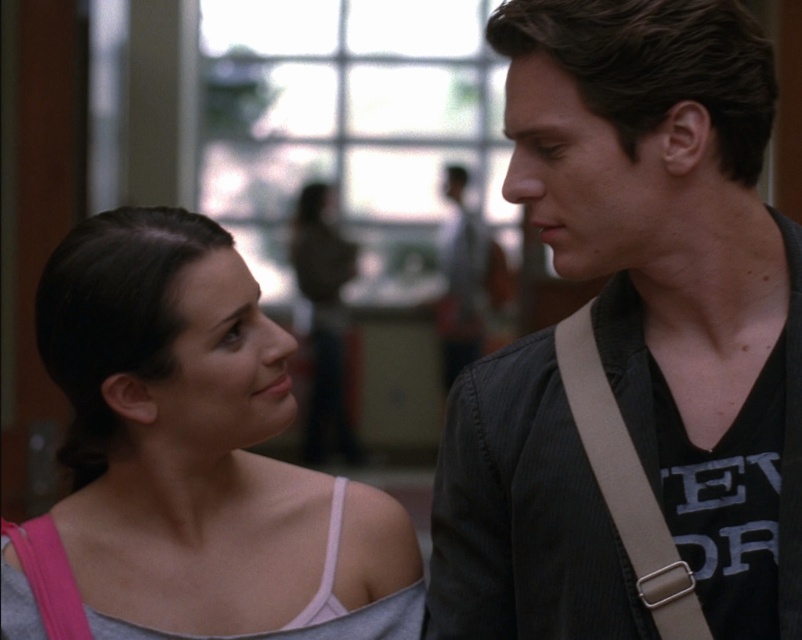
Who is positioned more to the right, gray fabric tank top at left or tan fabric strap at right?

tan fabric strap at right

Does gray fabric tank top at left lie in front of tan fabric strap at right?

No, gray fabric tank top at left is further to the viewer.

Where is `gray fabric tank top at left`? gray fabric tank top at left is located at coordinates (189, 461).

Does point (557, 64) lie in front of point (624, 444)?

That is True.

Does dark gray corduroy jacket at center lie in front of tan fabric strap at right?

Yes.

The width and height of the screenshot is (802, 640). Find the location of `dark gray corduroy jacket at center`. dark gray corduroy jacket at center is located at coordinates (634, 342).

Looking at this image, who is more distant from viewer, (x=764, y=314) or (x=82, y=419)?

The point (x=82, y=419) is more distant.

How much distance is there between dark gray corduroy jacket at center and gray fabric tank top at left?

22.43 inches

Where is `dark gray corduroy jacket at center`? The height and width of the screenshot is (640, 802). dark gray corduroy jacket at center is located at coordinates (634, 342).